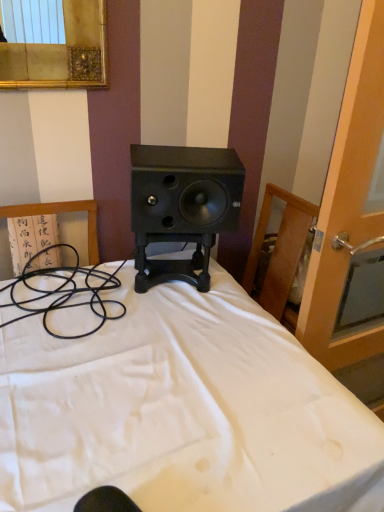
Question: Is white matte bed at center not within transparent glass screen door at right?

Choices:
 (A) no
 (B) yes

Answer: (B)

Question: Considering the relative sizes of white matte bed at center and transparent glass screen door at right in the image provided, is white matte bed at center wider than transparent glass screen door at right?

Choices:
 (A) no
 (B) yes

Answer: (B)

Question: Are white matte bed at center and transparent glass screen door at right beside each other?

Choices:
 (A) yes
 (B) no

Answer: (B)

Question: Is the depth of white matte bed at center less than that of transparent glass screen door at right?

Choices:
 (A) yes
 (B) no

Answer: (A)

Question: Is transparent glass screen door at right at the back of white matte bed at center?

Choices:
 (A) no
 (B) yes

Answer: (A)

Question: From the image's perspective, is black matte speaker at center positioned above or below transparent glass screen door at right?

Choices:
 (A) above
 (B) below

Answer: (A)

Question: Would you say black matte speaker at center is inside or outside transparent glass screen door at right?

Choices:
 (A) outside
 (B) inside

Answer: (A)

Question: From a real-world perspective, is black matte speaker at center above or below transparent glass screen door at right?

Choices:
 (A) above
 (B) below

Answer: (A)

Question: Based on their positions, is black matte speaker at center located to the left or right of transparent glass screen door at right?

Choices:
 (A) left
 (B) right

Answer: (A)

Question: Looking at the image, does transparent glass screen door at right seem bigger or smaller compared to white matte bed at center?

Choices:
 (A) small
 (B) big

Answer: (A)

Question: Choose the correct answer: Is transparent glass screen door at right inside white matte bed at center or outside it?

Choices:
 (A) outside
 (B) inside

Answer: (A)

Question: Does point (357, 31) appear closer or farther from the camera than point (102, 353)?

Choices:
 (A) closer
 (B) farther

Answer: (A)

Question: Considering the positions of transparent glass screen door at right and white matte bed at center in the image, is transparent glass screen door at right taller or shorter than white matte bed at center?

Choices:
 (A) tall
 (B) short

Answer: (A)

Question: From the image's perspective, is white matte bed at center located above or below transparent glass screen door at right?

Choices:
 (A) below
 (B) above

Answer: (A)

Question: Looking at their shapes, would you say white matte bed at center is wider or thinner than transparent glass screen door at right?

Choices:
 (A) wide
 (B) thin

Answer: (A)